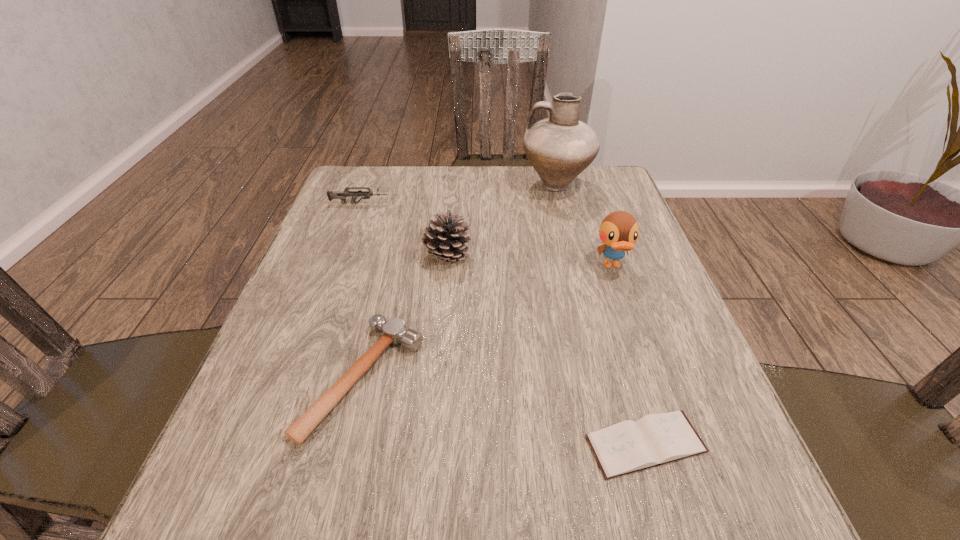
Image resolution: width=960 pixels, height=540 pixels. I want to click on the tallest object, so click(x=559, y=148).

The width and height of the screenshot is (960, 540). I want to click on duck, so click(619, 231).

I want to click on pinecone, so click(444, 237).

What are the coordinates of `gun` in the screenshot? It's located at (341, 195).

The width and height of the screenshot is (960, 540). I want to click on hammer, so click(394, 331).

Where is `the shortest object`? the shortest object is located at coordinates (629, 446).

Find the location of `vacant space located 0.400m on the handle side of the tallest object`. vacant space located 0.400m on the handle side of the tallest object is located at coordinates (377, 185).

At what (x,y) coordinates should I click in order to perform the action: click on vacant region located on the handle side of the tallest object. Please return your answer as a coordinate pair (x, y). Looking at the image, I should click on (427, 185).

The image size is (960, 540). I want to click on free point located 0.330m on the handle side of the tallest object, so click(402, 185).

Locate an element on the screen. The height and width of the screenshot is (540, 960). vacant space located on the front-facing side of the duck is located at coordinates (672, 440).